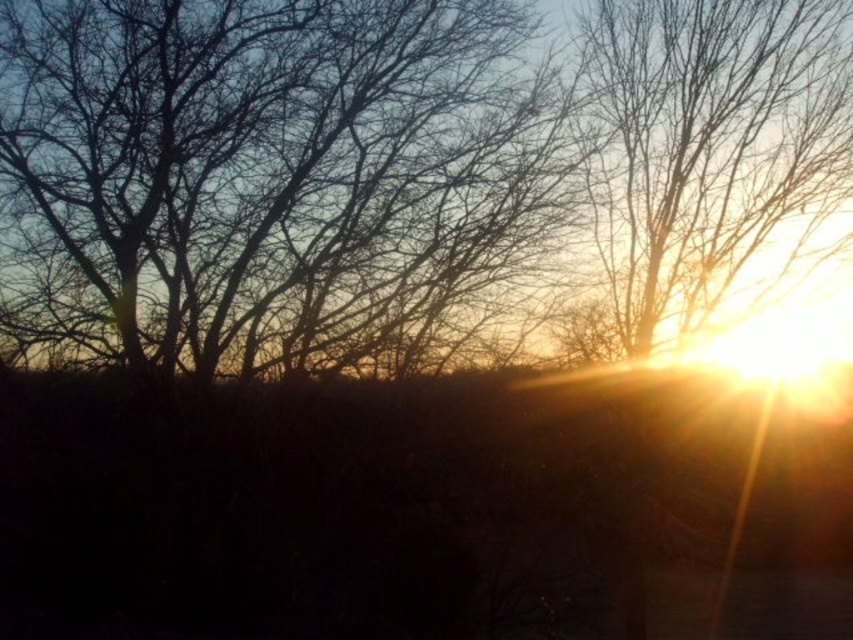
Does brown/dry wood tree at upper left appear on the left side of translucent golden sun at upper right?

Yes, brown/dry wood tree at upper left is to the left of translucent golden sun at upper right.

In the scene shown: Between brown/dry wood tree at upper left and translucent golden sun at upper right, which one is positioned higher?

translucent golden sun at upper right is above.

Between point (440, 168) and point (793, 48), which one is positioned in front?

Point (793, 48) is in front.

Find the location of a particular element. brown/dry wood tree at upper left is located at coordinates (280, 182).